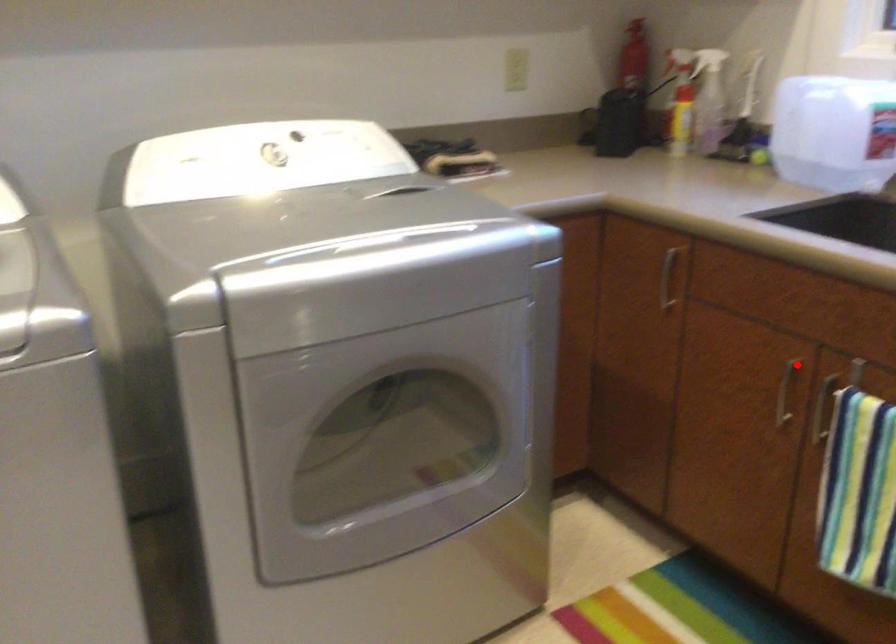
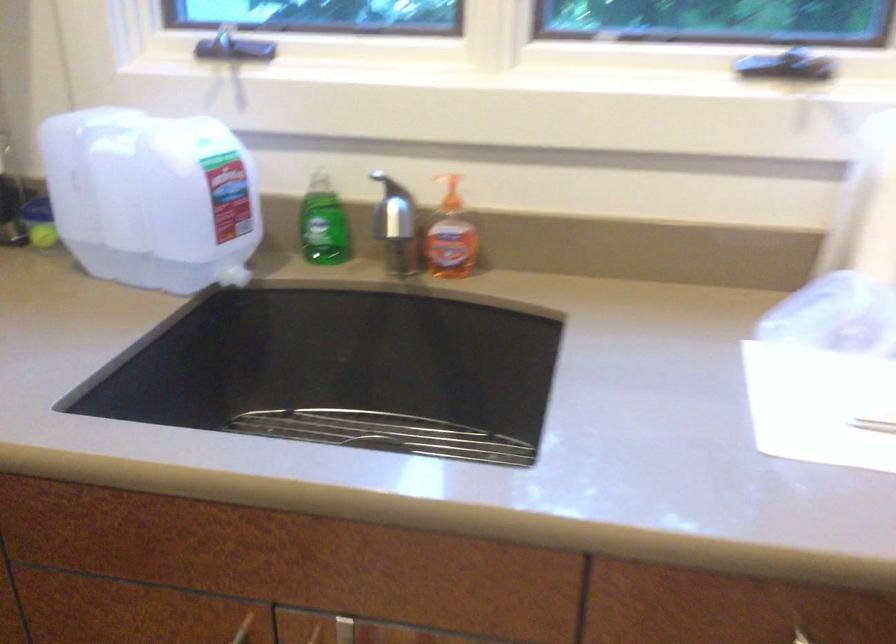
Question: I am providing you with two images of the same scene from different viewpoints. A red point is shown in image1. For the corresponding object point in image2, is it positioned nearer or farther from the camera?

Choices:
 (A) Nearer
 (B) Farther

Answer: (A)